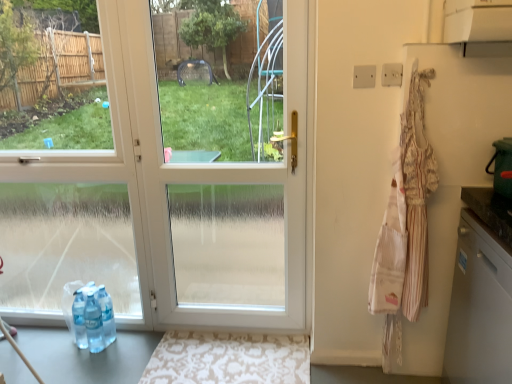
The width and height of the screenshot is (512, 384). I want to click on white glossy door at center, so click(230, 165).

What do you see at coordinates (230, 165) in the screenshot?
I see `white glossy door at center` at bounding box center [230, 165].

Image resolution: width=512 pixels, height=384 pixels. I want to click on white glossy dishwasher at right, so click(x=479, y=308).

In order to face white glossy dishwasher at right, should I rotate leftwards or rightwards?

It's best to rotate right around 31.963 degrees.

What do you see at coordinates (228, 359) in the screenshot?
I see `beige damask rug at lower center` at bounding box center [228, 359].

The height and width of the screenshot is (384, 512). Find the location of `white glossy door at center`. white glossy door at center is located at coordinates (230, 165).

You are a GUI agent. You are given a task and a screenshot of the screen. Output one action in this format:
    pyautogui.click(x=<x>, y=<y>)
    Task: Click on the laundry below the white glossy door at center (from a real-world perspective)
    
    Given the screenshot: What is the action you would take?
    pyautogui.click(x=405, y=227)

Can you confirm if striped cotton apron at right is positioned to the right of white glossy door at center?

Yes, striped cotton apron at right is to the right of white glossy door at center.

Do you think striped cotton apron at right is within white glossy door at center, or outside of it?

striped cotton apron at right is located beyond the bounds of white glossy door at center.

How much distance is there between white glossy door at center and white glossy dishwasher at right?

white glossy door at center and white glossy dishwasher at right are 9.00 feet apart.

Is white glossy door at center oriented away from white glossy dishwasher at right?

Result: white glossy door at center does not have its back to white glossy dishwasher at right.

This screenshot has height=384, width=512. Identify the location of glass door lying on the left of white glossy dishwasher at right. (230, 165).

Between striped cotton apron at right and beige damask rug at lower center, which one is positioned in front?

Positioned in front is striped cotton apron at right.

Does striped cotton apron at right have a greater height compared to beige damask rug at lower center?

Yes.

Between striped cotton apron at right and beige damask rug at lower center, which one appears on the right side from the viewer's perspective?

Positioned to the right is striped cotton apron at right.

Looking at this image, which object is positioned more to the left, white glossy dishwasher at right or white glossy door at center?

From the viewer's perspective, white glossy door at center appears more on the left side.

Could you tell me if white glossy dishwasher at right is facing white glossy door at center?

Yes.

Is white glossy dishwasher at right bigger or smaller than white glossy door at center?

white glossy dishwasher at right is bigger than white glossy door at center.

Which point is more forward, (463,348) or (232,272)?

The point (463,348) is closer to the camera.

Does point (194, 358) lie in front of point (472, 307)?

No, it is not.

Is beige damask rug at lower center positioned with its back to white glossy dishwasher at right?

beige damask rug at lower center is not turned away from white glossy dishwasher at right.

From a real-world perspective, which object stands above the other?

In real-world perspective, white glossy dishwasher at right is above.

Is white glossy dishwasher at right not within beige damask rug at lower center?

white glossy dishwasher at right lies outside beige damask rug at lower center's area.

Is white glossy dishwasher at right placed right next to beige damask rug at lower center?

No, white glossy dishwasher at right is not next to beige damask rug at lower center.

From a real-world perspective, which object rests below the other?

From a 3D spatial view, beige damask rug at lower center is below.

Is white glossy dishwasher at right taller or shorter than beige damask rug at lower center?

Considering their sizes, white glossy dishwasher at right has more height than beige damask rug at lower center.

Choose the correct answer: Is beige damask rug at lower center inside striped cotton apron at right or outside it?

beige damask rug at lower center is not enclosed by striped cotton apron at right.

Which of these two, beige damask rug at lower center or striped cotton apron at right, is wider?

Wider between the two is beige damask rug at lower center.

From the image's perspective, would you say beige damask rug at lower center is shown under striped cotton apron at right?

Yes, from the image's perspective, beige damask rug at lower center is below striped cotton apron at right.

Find the location of a particular element. The width and height of the screenshot is (512, 384). glass door on the left of striped cotton apron at right is located at coordinates (230, 165).

In order to click on dish washer in front of the white glossy door at center in this screenshot , I will do `click(479, 308)`.

Estimate the real-world distances between objects in this image. Which object is closer to beige damask rug at lower center, white glossy door at center or striped cotton apron at right?

The object closer to beige damask rug at lower center is striped cotton apron at right.

Looking at the image, which one is located further to white glossy door at center, beige damask rug at lower center or white glossy dishwasher at right?

white glossy dishwasher at right lies further to white glossy door at center than the other object.

Which object lies further to the anchor point striped cotton apron at right, white glossy door at center or white glossy dishwasher at right?

Based on the image, white glossy door at center appears to be further to striped cotton apron at right.

Considering their positions, is beige damask rug at lower center positioned closer to white glossy door at center than striped cotton apron at right?

beige damask rug at lower center is positioned closer to the anchor white glossy door at center.

Looking at the image, which one is located closer to white glossy door at center, striped cotton apron at right or beige damask rug at lower center?

beige damask rug at lower center is closer to white glossy door at center.

Which object lies nearer to the anchor point white glossy dishwasher at right, white glossy door at center or beige damask rug at lower center?

The object closer to white glossy dishwasher at right is beige damask rug at lower center.

When comparing their distances from beige damask rug at lower center, does white glossy dishwasher at right or white glossy door at center seem closer?

Based on the image, white glossy dishwasher at right appears to be nearer to beige damask rug at lower center.

Considering their positions, is white glossy dishwasher at right positioned further to striped cotton apron at right than white glossy door at center?

Among the two, white glossy door at center is located further to striped cotton apron at right.

Locate an element on the screen. The width and height of the screenshot is (512, 384). doormat between white glossy door at center and white glossy dishwasher at right from left to right is located at coordinates (228, 359).

Where is `laundry between white glossy door at center and white glossy dishwasher at right from left to right`? This screenshot has height=384, width=512. laundry between white glossy door at center and white glossy dishwasher at right from left to right is located at coordinates (405, 227).

Identify the location of laundry situated between beige damask rug at lower center and white glossy dishwasher at right from left to right. The image size is (512, 384). (405, 227).

What are the coordinates of `laundry that lies between white glossy door at center and beige damask rug at lower center from top to bottom` in the screenshot? It's located at (405, 227).